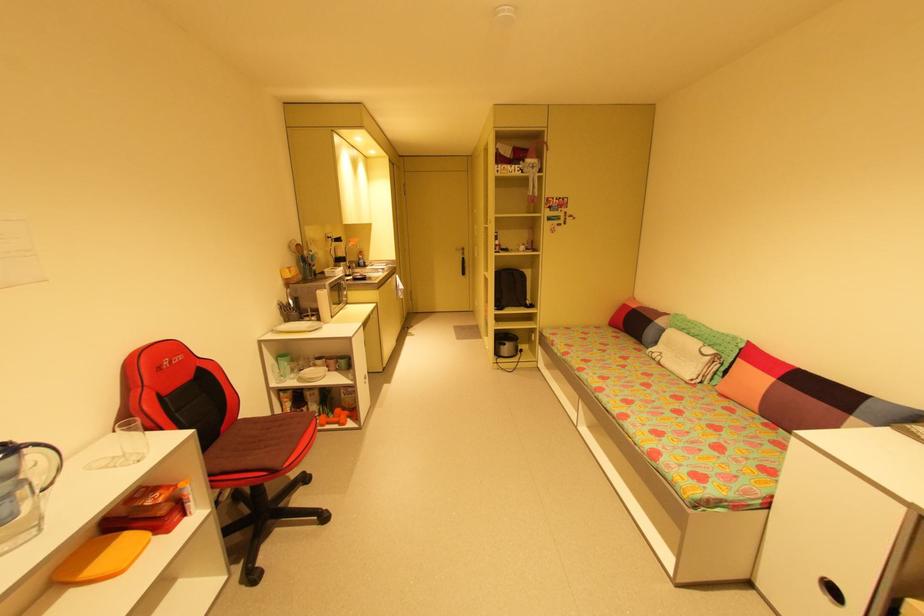
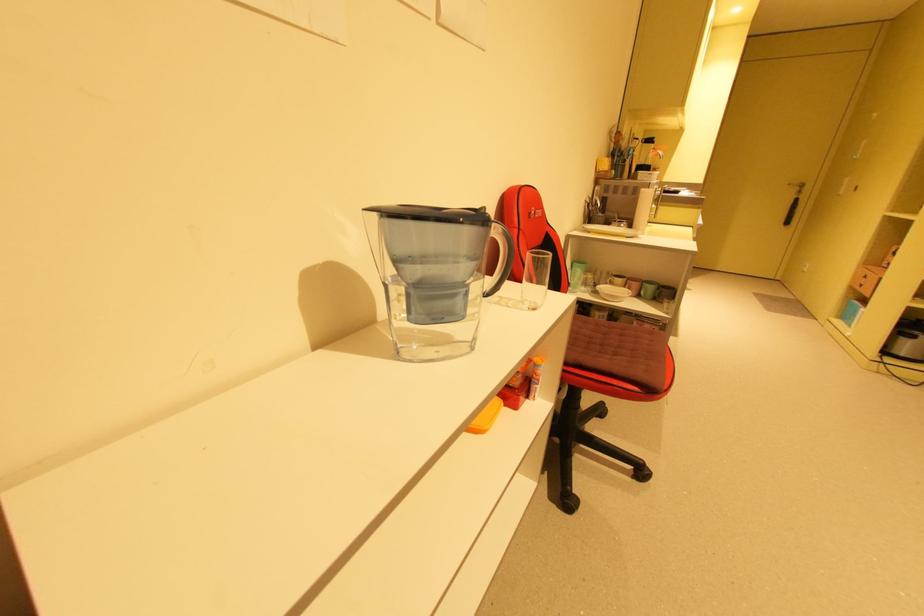
Question: The first image is from the beginning of the video and the second image is from the end. How did the camera likely rotate when shooting the video?

Choices:
 (A) Left
 (B) Right
 (C) Up
 (D) Down

Answer: (A)